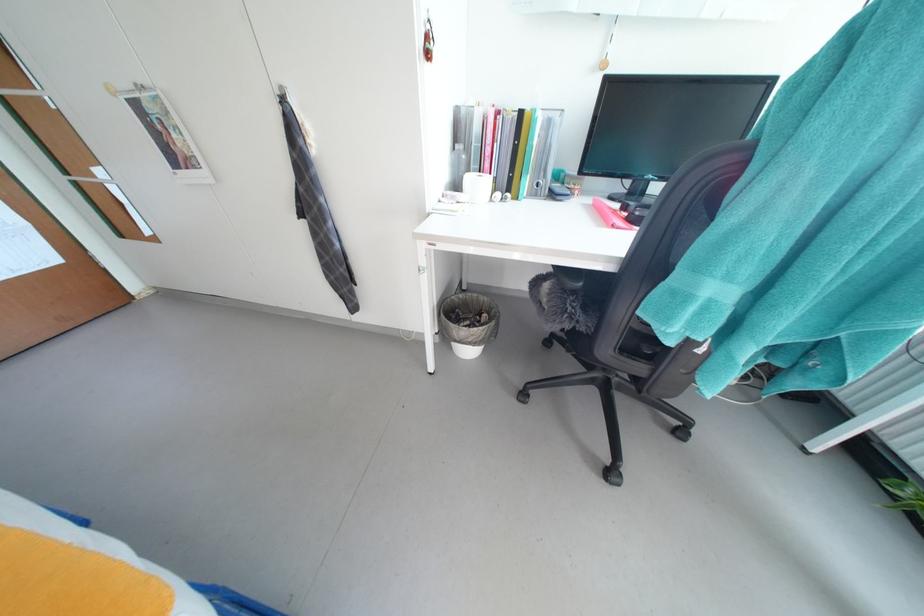
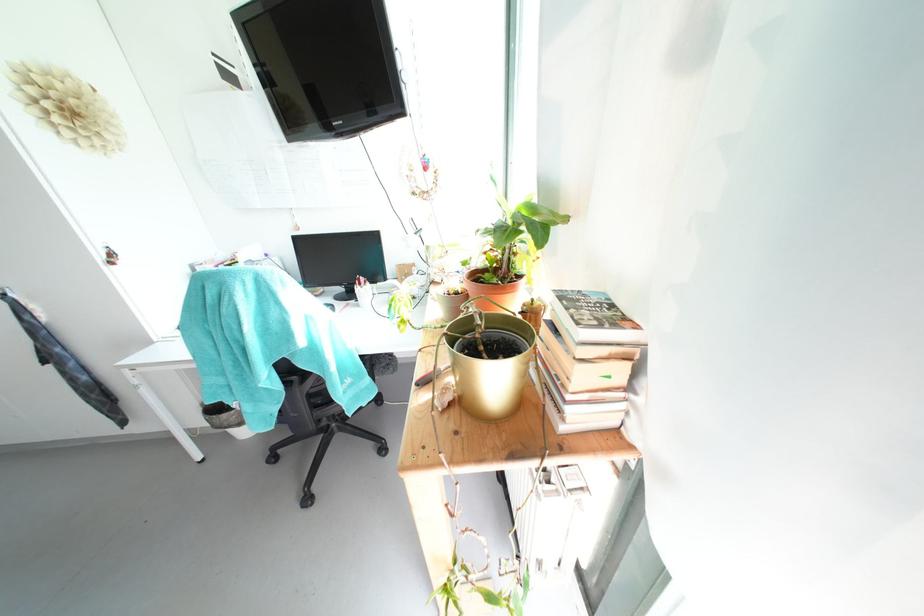
Consider the image. Which direction would the cameraman need to move to produce the second image?

The cameraman moved toward right, backward.